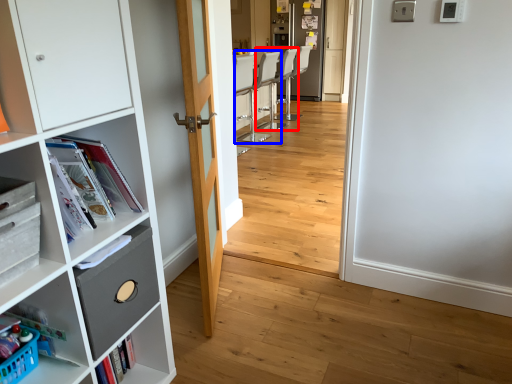
Question: Which object is closer to the camera taking this photo, armchair (highlighted by a red box) or chair (highlighted by a blue box)?

Choices:
 (A) armchair
 (B) chair

Answer: (B)